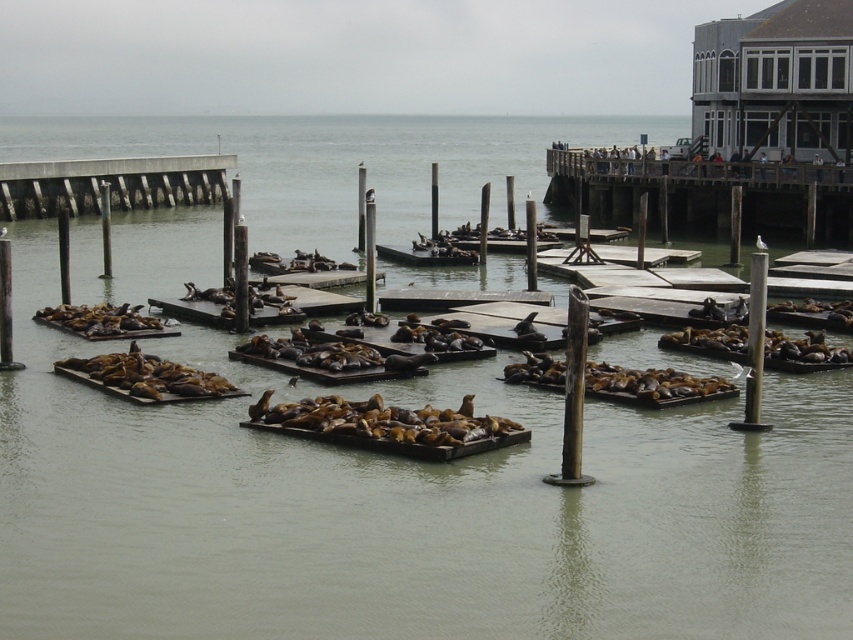
You are standing on the wooden dock at upper right and want to reach the wooden planks at left. According to the scene, which direction should you move to get there?

The wooden dock at upper right is positioned under the wooden planks at left, so you should move upward to reach the wooden planks at left.

You are a marine biologist observing the waterfront scene. You need to place a 3m wide research equipment between the wooden dock at upper right and the wooden planks at left. Can you fit it based on their widths?

The wooden dock at upper right is wider than the wooden planks at left. Since the equipment is 3m wide, you need to check if the combined width of both objects is at least 3m. However, without exact measurements, it is uncertain if there is enough space. Please verify the exact dimensions before placing the equipment.

You are standing at the center of the image and want to locate the wooden dock at upper right. According to the coordinates provided, in which direction should you look to find it?

The wooden dock at upper right is located at coordinates point (703, 193). Since you are at the center, you should look towards the upper right direction to find it.